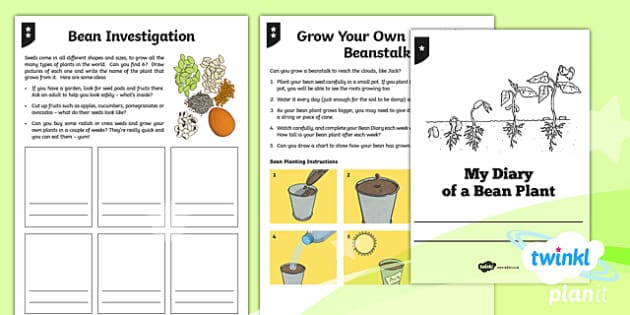
The width and height of the screenshot is (630, 315). What are the coordinates of `pot` in the screenshot? It's located at (298, 197), (375, 204), (297, 267), (390, 267).